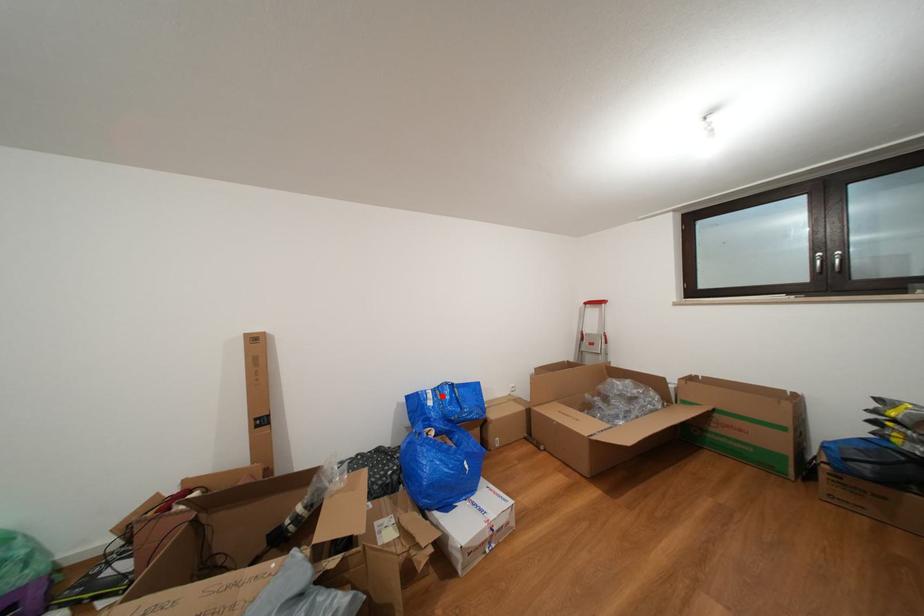
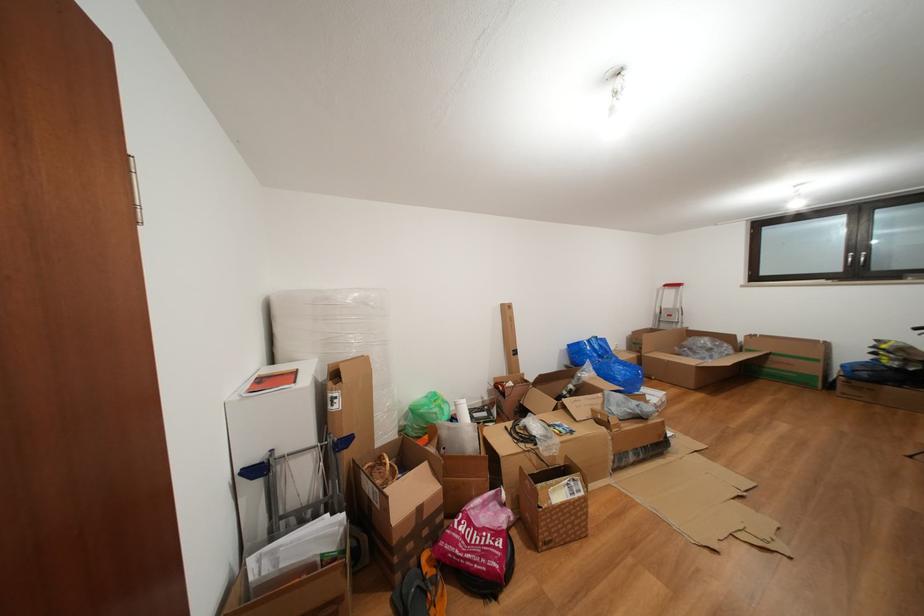
Question: I am providing you with two images of the same scene from different viewpoints. In image1, a red point is highlighted. Considering the same 3D point in image2, which of the following is correct?

Choices:
 (A) It is closer
 (B) It is farther

Answer: (A)